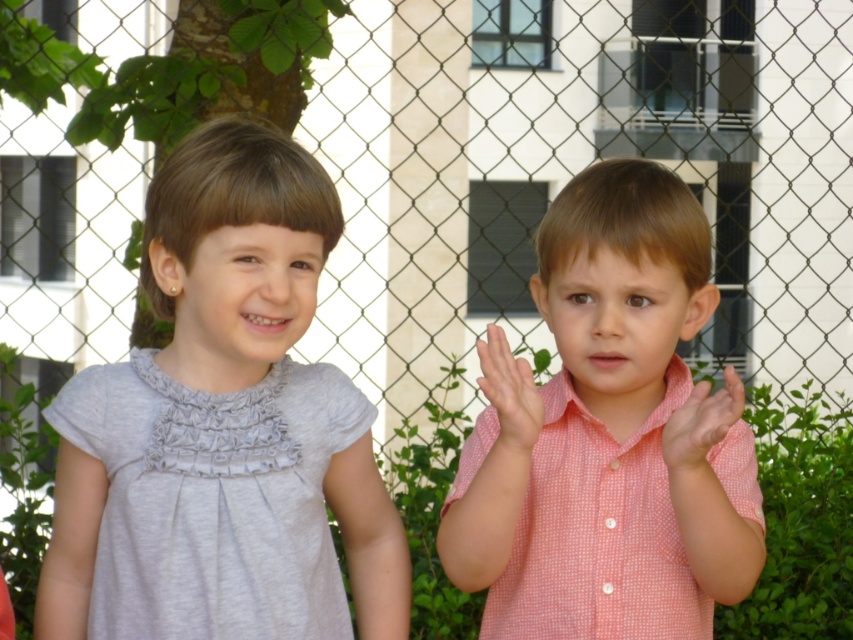
Can you confirm if pink dotted shirt at center is positioned below pink checkered shirt at right?

Correct, pink dotted shirt at center is located below pink checkered shirt at right.

Which is behind, point (485, 346) or point (694, 426)?

The point (485, 346) is more distant.

This screenshot has height=640, width=853. Describe the element at coordinates (509, 396) in the screenshot. I see `pink dotted shirt at center` at that location.

What are the coordinates of `pink dotted shirt at center` in the screenshot? It's located at (509, 396).

Who is higher up, gray matte dress at left or pink checkered shirt at right?

pink checkered shirt at right

Which is below, gray matte dress at left or pink checkered shirt at right?

gray matte dress at left is below.

This screenshot has height=640, width=853. I want to click on gray matte dress at left, so click(x=234, y=260).

I want to click on gray matte dress at left, so click(x=234, y=260).

Does point (674, 579) lie behind point (218, 259)?

Yes.

Between pink checkered shirt at center and gray matte dress at left, which one is positioned lower?

pink checkered shirt at center is below.

At what (x,y) coordinates should I click in order to perform the action: click on pink checkered shirt at center. Please return your answer as a coordinate pair (x, y). The width and height of the screenshot is (853, 640). Looking at the image, I should click on (608, 433).

Image resolution: width=853 pixels, height=640 pixels. In order to click on pink checkered shirt at center in this screenshot , I will do `click(608, 433)`.